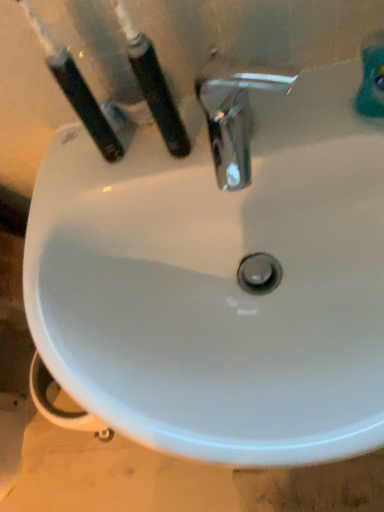
Question: Does black plastic toothbrush at upper left, positioned as the second toothbrush in right-to-left order, appear on the right side of black plastic toothbrush at upper left, the second toothbrush viewed from the left?

Choices:
 (A) no
 (B) yes

Answer: (A)

Question: Does black plastic toothbrush at upper left, positioned as the second toothbrush in right-to-left order, have a lesser width compared to black plastic toothbrush at upper left, the second toothbrush viewed from the left?

Choices:
 (A) yes
 (B) no

Answer: (B)

Question: From a real-world perspective, is black plastic toothbrush at upper left, positioned as the second toothbrush in right-to-left order, located beneath black plastic toothbrush at upper left, the second toothbrush viewed from the left?

Choices:
 (A) no
 (B) yes

Answer: (A)

Question: Does black plastic toothbrush at upper left, positioned as the second toothbrush in right-to-left order, have a greater width compared to black plastic toothbrush at upper left, the 1th toothbrush viewed from the right?

Choices:
 (A) no
 (B) yes

Answer: (B)

Question: Is black plastic toothbrush at upper left, acting as the 1th toothbrush starting from the left, aimed at black plastic toothbrush at upper left, the second toothbrush viewed from the left?

Choices:
 (A) no
 (B) yes

Answer: (A)

Question: From the image's perspective, is black plastic toothbrush at upper left, positioned as the second toothbrush in right-to-left order, over black plastic toothbrush at upper left, the 1th toothbrush viewed from the right?

Choices:
 (A) yes
 (B) no

Answer: (A)

Question: Is black plastic toothbrush at upper left, the 1th toothbrush viewed from the right, far away from black plastic toothbrush at upper left, acting as the 1th toothbrush starting from the left?

Choices:
 (A) no
 (B) yes

Answer: (A)

Question: Does black plastic toothbrush at upper left, the second toothbrush viewed from the left, appear on the left side of black plastic toothbrush at upper left, positioned as the second toothbrush in right-to-left order?

Choices:
 (A) yes
 (B) no

Answer: (B)

Question: Can you confirm if black plastic toothbrush at upper left, the 1th toothbrush viewed from the right, is smaller than black plastic toothbrush at upper left, positioned as the second toothbrush in right-to-left order?

Choices:
 (A) no
 (B) yes

Answer: (B)

Question: Is black plastic toothbrush at upper left, the 1th toothbrush viewed from the right, facing towards black plastic toothbrush at upper left, acting as the 1th toothbrush starting from the left?

Choices:
 (A) no
 (B) yes

Answer: (A)

Question: Considering the relative sizes of black plastic toothbrush at upper left, the second toothbrush viewed from the left, and black plastic toothbrush at upper left, positioned as the second toothbrush in right-to-left order, in the image provided, is black plastic toothbrush at upper left, the second toothbrush viewed from the left, shorter than black plastic toothbrush at upper left, positioned as the second toothbrush in right-to-left order,?

Choices:
 (A) yes
 (B) no

Answer: (A)

Question: Is black plastic toothbrush at upper left, the 1th toothbrush viewed from the right, at the right side of black plastic toothbrush at upper left, positioned as the second toothbrush in right-to-left order?

Choices:
 (A) no
 (B) yes

Answer: (B)

Question: Looking at their shapes, would you say black plastic toothbrush at upper left, the second toothbrush viewed from the left, is wider or thinner than black plastic toothbrush at upper left, positioned as the second toothbrush in right-to-left order?

Choices:
 (A) wide
 (B) thin

Answer: (B)